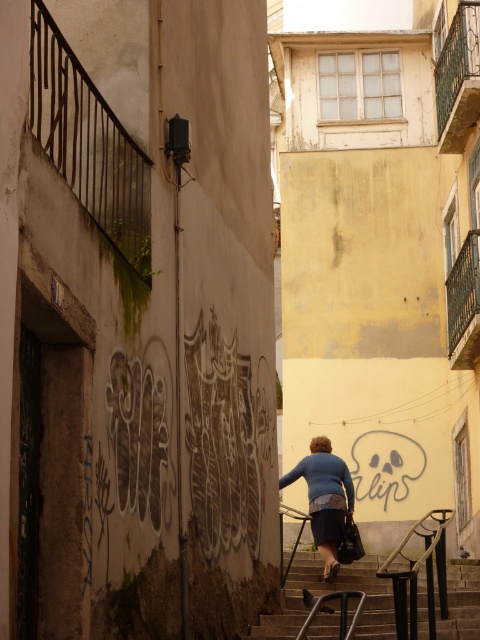
Is point (478, 561) positioned after point (315, 529)?

Yes, point (478, 561) is behind point (315, 529).

The width and height of the screenshot is (480, 640). What are the coordinates of `stone textured stairs at center` in the screenshot? It's located at (326, 593).